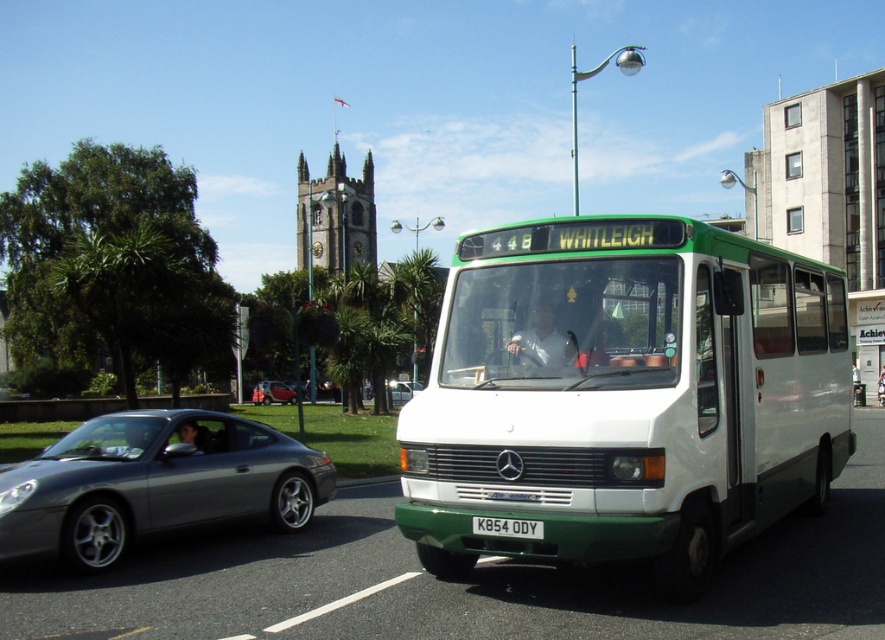
Is white matte bus at center wider than white plastic license plate at center?

Correct, the width of white matte bus at center exceeds that of white plastic license plate at center.

Is white matte bus at center thinner than white plastic license plate at center?

No.

Does point (782, 365) lie in front of point (475, 516)?

That is False.

At what (x,y) coordinates should I click in order to perform the action: click on white matte bus at center. Please return your answer as a coordinate pair (x, y). Looking at the image, I should click on (624, 396).

Which is more to the right, white matte bus at center or satin silver car at left?

From the viewer's perspective, white matte bus at center appears more on the right side.

Is point (580, 269) less distant than point (219, 458)?

Yes.

This screenshot has width=885, height=640. In order to click on white matte bus at center in this screenshot , I will do `click(624, 396)`.

Does green plastic bus stop at center have a greater height compared to metallic silver car at center?

Correct, green plastic bus stop at center is much taller as metallic silver car at center.

Measure the distance between point (x=866, y=308) and camera.

The distance of point (x=866, y=308) from camera is 54.95 meters.

Does point (871, 316) lie behind point (287, 388)?

Yes, point (871, 316) is farther from viewer.

Find the location of a particular element. The width and height of the screenshot is (885, 640). green plastic bus stop at center is located at coordinates (867, 336).